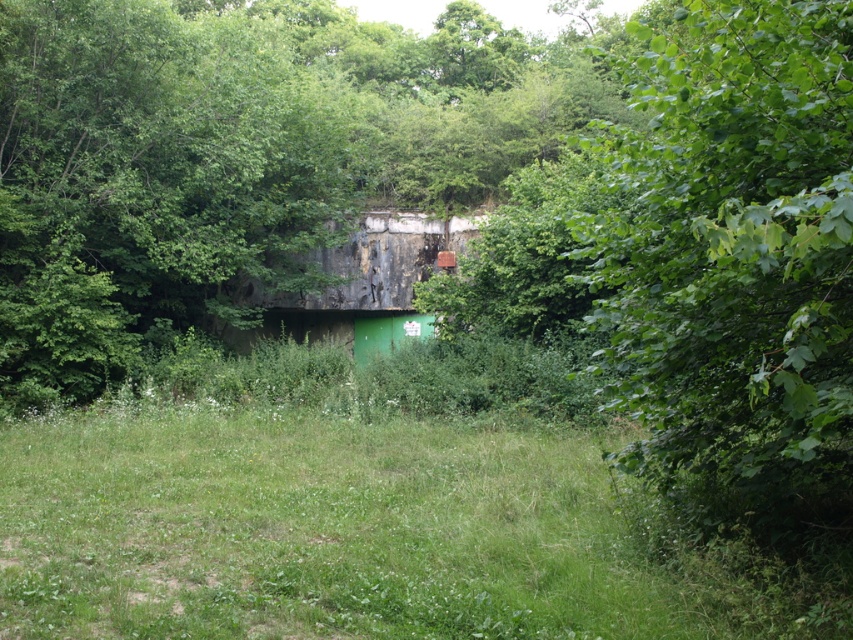
Question: Observing the image, what is the correct spatial positioning of green grass at center in reference to green leafy tree at right?

Choices:
 (A) above
 (B) below

Answer: (B)

Question: Does green grass at center appear under green leafy tree at right?

Choices:
 (A) yes
 (B) no

Answer: (A)

Question: In this image, where is green grass at center located relative to green leafy tree at right?

Choices:
 (A) right
 (B) left

Answer: (B)